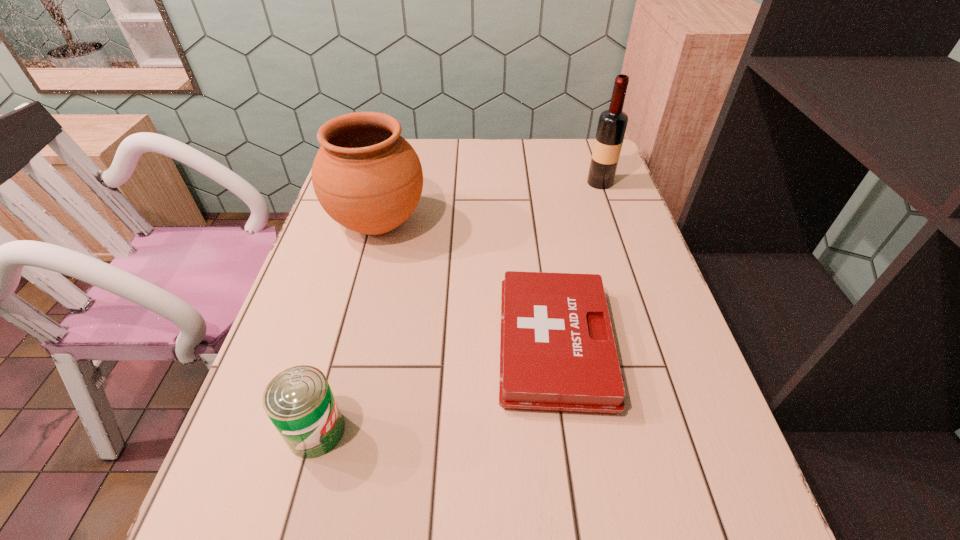
You are a GUI agent. You are given a task and a screenshot of the screen. Output one action in this format:
    pyautogui.click(x=<x>, y=<y>)
    Task: Click on the free space located on the back of the first-aid kit
    
    Given the screenshot: What is the action you would take?
    pyautogui.click(x=535, y=206)

The height and width of the screenshot is (540, 960). I want to click on object at the far edge, so click(612, 124).

Identify the location of pottery at the left edge. (366, 176).

In order to click on can present at the left edge in this screenshot , I will do `click(299, 401)`.

Locate an element on the screen. wine bottle that is positioned at the right edge is located at coordinates (612, 124).

You are a GUI agent. You are given a task and a screenshot of the screen. Output one action in this format:
    pyautogui.click(x=<x>, y=<y>)
    Task: Click on the first-aid kit at the right edge
    Image resolution: width=960 pixels, height=540 pixels.
    Given the screenshot: What is the action you would take?
    (x=557, y=351)

The image size is (960, 540). In order to click on object present at the far right corner in this screenshot , I will do `click(612, 124)`.

The height and width of the screenshot is (540, 960). I want to click on vacant space at the far edge of the desktop, so point(429,175).

Image resolution: width=960 pixels, height=540 pixels. I want to click on vacant region at the left edge, so click(330, 318).

Find the location of a particular element. Image resolution: width=960 pixels, height=540 pixels. vacant space at the right edge of the desktop is located at coordinates (681, 512).